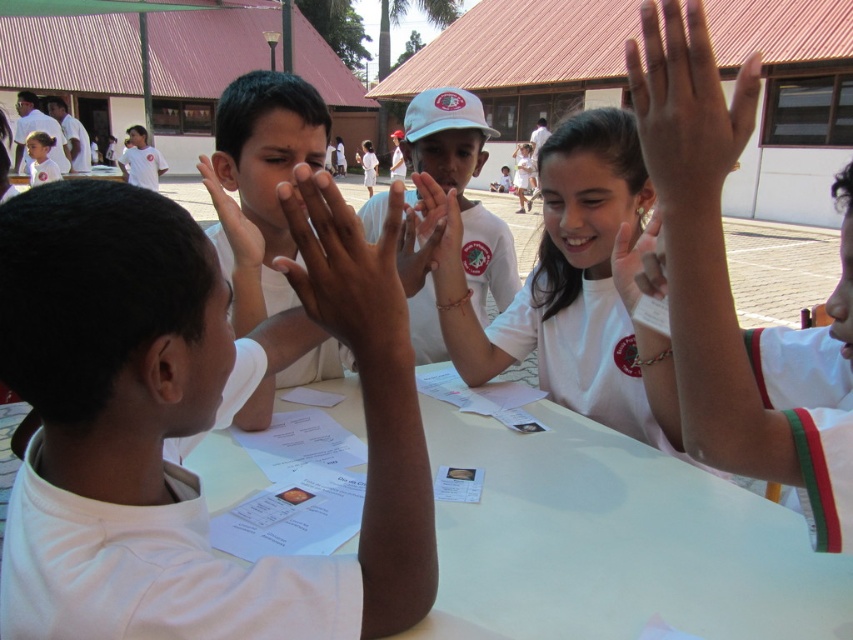
Does white matte cap at center have a lesser height compared to matte white hand at upper center?

Incorrect, white matte cap at center's height does not fall short of matte white hand at upper center's.

Which of these two, white matte cap at center or matte white hand at upper center, stands taller?

Standing taller between the two is white matte cap at center.

Consider the image. Measure the distance between white matte cap at center and camera.

1.35 meters

Find the location of `white matte cap at center`. white matte cap at center is located at coordinates (462, 186).

Is white matte shirt at upper left shorter than smooth skin hand at center?

No.

Who is more forward, (x=102, y=285) or (x=428, y=211)?

Point (x=102, y=285) is in front.

Find the location of a particular element. The width and height of the screenshot is (853, 640). white matte shirt at upper left is located at coordinates (109, 333).

I want to click on white matte shirt at upper left, so coord(109,333).

Between white matte shirt at upper left and matte white hand at upper right, which one is positioned higher?

matte white hand at upper right is above.

Which is below, white matte shirt at upper left or matte white hand at upper right?

white matte shirt at upper left

Is point (178, 230) behind point (635, 104)?

No.

Image resolution: width=853 pixels, height=640 pixels. Find the location of `white matte shirt at upper left`. white matte shirt at upper left is located at coordinates (109, 333).